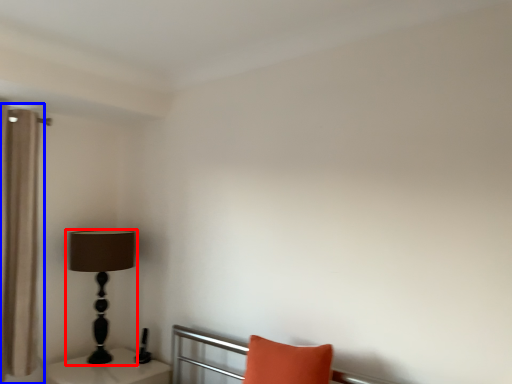
Question: Which of the following is the farthest to the observer, lamp (highlighted by a red box) or curtain (highlighted by a blue box)?

Choices:
 (A) lamp
 (B) curtain

Answer: (A)